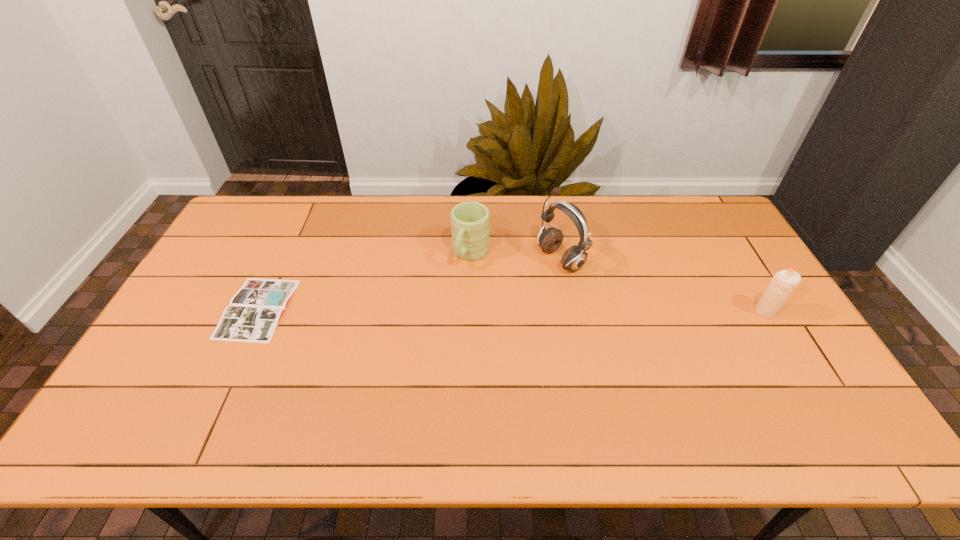
Locate an element on the screen. vacant space at the left edge is located at coordinates (232, 271).

Image resolution: width=960 pixels, height=540 pixels. In the image, there is a desktop. Find the location of `vacant space at the right edge`. vacant space at the right edge is located at coordinates (756, 279).

At what (x,y) coordinates should I click in order to perform the action: click on vacant region at the far right corner of the desktop. Please return your answer as a coordinate pair (x, y). Looking at the image, I should click on (714, 224).

The image size is (960, 540). Find the location of `free point between the mug and the shortest object`. free point between the mug and the shortest object is located at coordinates (364, 281).

Locate an element on the screen. free point between the candle and the leftmost object is located at coordinates (512, 310).

Find the location of `free space between the mug and the tallest object`. free space between the mug and the tallest object is located at coordinates (516, 256).

You are a GUI agent. You are given a task and a screenshot of the screen. Output one action in this format:
    pyautogui.click(x=<x>, y=<y>)
    Task: Click on the vacant space that's between the mug and the earphone
    
    Given the screenshot: What is the action you would take?
    pyautogui.click(x=516, y=256)

At what (x,y) coordinates should I click in order to perform the action: click on free space between the rightmost object and the shortest object. Please return your answer as a coordinate pair (x, y). This screenshot has width=960, height=540. Looking at the image, I should click on (512, 310).

At what (x,y) coordinates should I click in order to perform the action: click on vacant space in between the tallest object and the candle. Please return your answer as a coordinate pair (x, y). Looking at the image, I should click on (662, 286).

You are a GUI agent. You are given a task and a screenshot of the screen. Output one action in this format:
    pyautogui.click(x=<x>, y=<y>)
    Task: Click on the free spot between the shortest object and the tallest object
    The width and height of the screenshot is (960, 540).
    Given the screenshot: What is the action you would take?
    pyautogui.click(x=409, y=284)